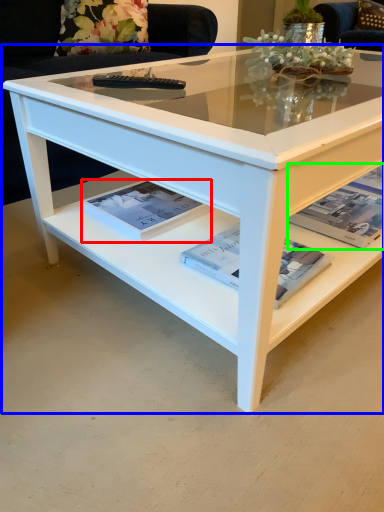
Question: Considering the real-world distances, which object is farthest from magazine (highlighted by a red box)? coffee table (highlighted by a blue box) or magazine (highlighted by a green box)?

Choices:
 (A) coffee table
 (B) magazine

Answer: (B)